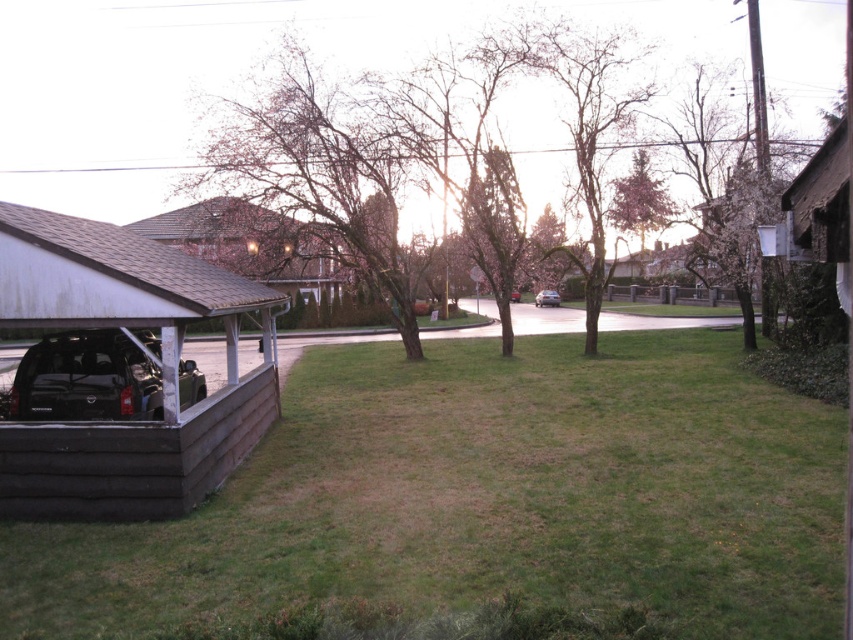
You are a delivery person trying to park your delivery van, which is 2 meters wide, in the driveway. You see the wooden carport at lower left and the black matte suv at lower left. Can you fit your van between them?

The wooden carport at lower left is smaller than the black matte suv at lower left. However, the description does not provide specific measurements of the space between them. Without knowing the exact distance, it is impossible to determine if the van can fit.